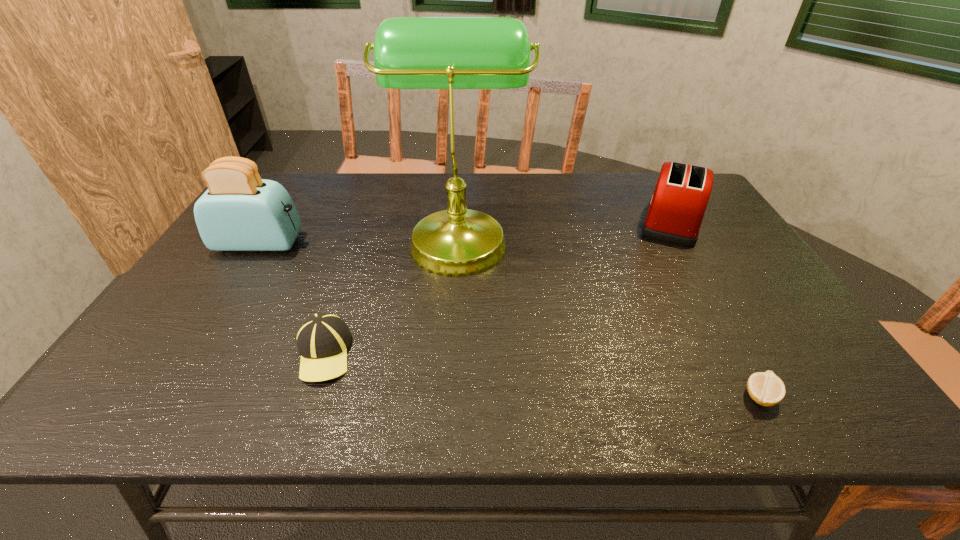
This screenshot has width=960, height=540. I want to click on object that is at the far right corner, so click(x=676, y=209).

You are a GUI agent. You are given a task and a screenshot of the screen. Output one action in this format:
    pyautogui.click(x=<x>, y=<y>)
    Task: Click on the object that is at the near right corner
    The image size is (960, 540).
    Given the screenshot: What is the action you would take?
    pyautogui.click(x=765, y=388)

Where is `free space at the far edge of the desktop`? free space at the far edge of the desktop is located at coordinates (556, 199).

In order to click on vacant point at the near edge in this screenshot , I will do `click(485, 384)`.

Image resolution: width=960 pixels, height=540 pixels. In the image, there is a desktop. Identify the location of vacant space at the left edge. (213, 287).

At what (x,y) coordinates should I click in order to perform the action: click on blank space at the right edge of the desktop. Please return your answer as a coordinate pair (x, y). The height and width of the screenshot is (540, 960). Looking at the image, I should click on (827, 356).

The height and width of the screenshot is (540, 960). Identify the location of vacant space at the far left corner of the desktop. pos(288,172).

Locate an element on the screen. The height and width of the screenshot is (540, 960). blank region between the shorter toaster and the lemon is located at coordinates (715, 309).

This screenshot has width=960, height=540. Identify the location of vacant space in between the baseball cap and the second tallest object. (292, 298).

Identify the location of free spot between the leftmost object and the baseball cap. This screenshot has height=540, width=960. pyautogui.click(x=292, y=298).